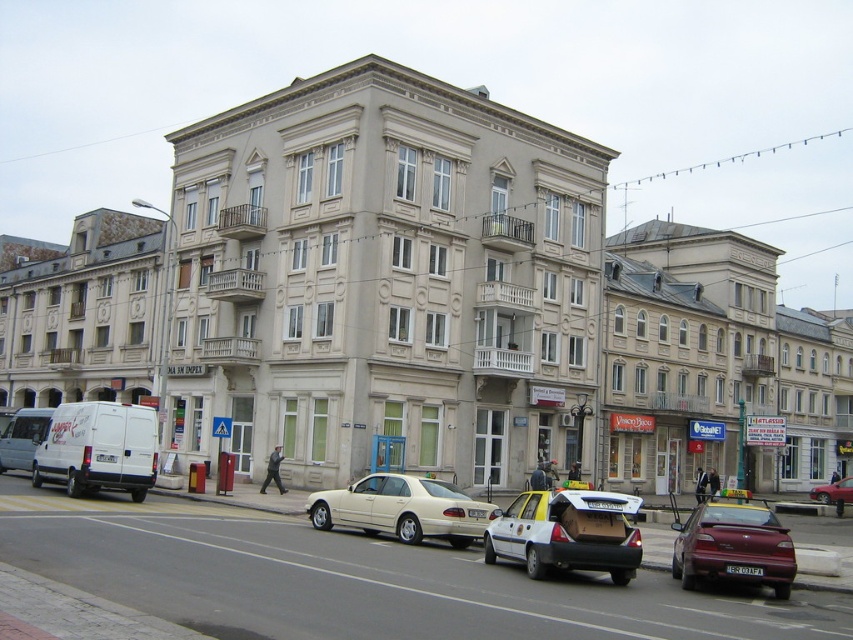
Between metallic silver sedan at center and white plastic license plate at center, which one has less height?

With less height is white plastic license plate at center.

Who is higher up, metallic silver sedan at center or white plastic license plate at center?

white plastic license plate at center

Is point (831, 492) positioned behind point (485, 516)?

Yes.

Locate an element on the screen. metallic silver sedan at center is located at coordinates (833, 492).

Is point (24, 448) positioned in front of point (831, 490)?

Yes, point (24, 448) is in front of point (831, 490).

Who is higher up, white matte van at left or metallic silver sedan at center?

Positioned higher is white matte van at left.

Does point (35, 445) come behind point (831, 484)?

No, (35, 445) is in front of (831, 484).

Locate an element on the screen. white matte van at left is located at coordinates (22, 436).

Does maroon glossy sedan at lower right lie behind white matte van at left?

No, it is not.

Is point (712, 572) farther from camera compared to point (44, 435)?

No.

What are the coordinates of `maroon glossy sedan at lower right` in the screenshot? It's located at (733, 547).